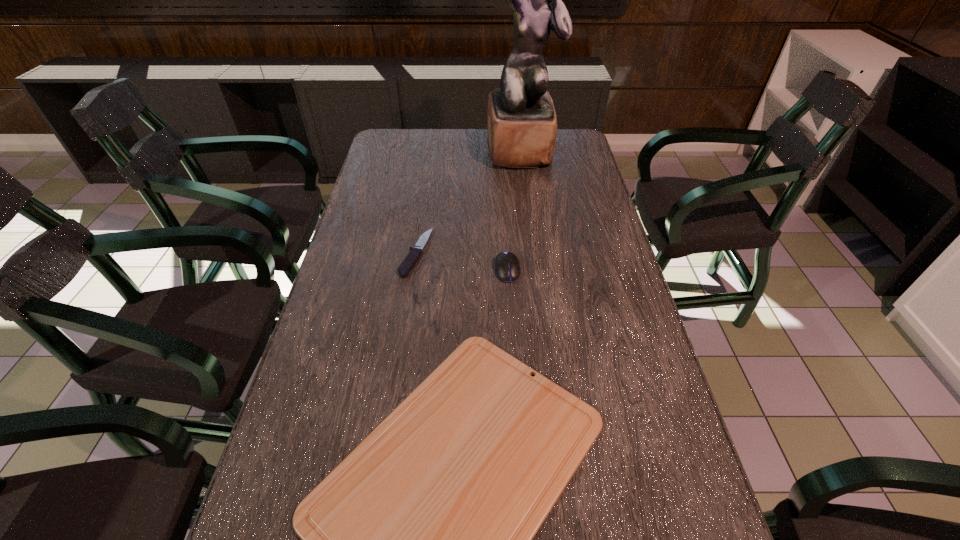
The height and width of the screenshot is (540, 960). Identify the location of free space at the far edge. (475, 131).

The height and width of the screenshot is (540, 960). I want to click on vacant space at the left edge of the desktop, so click(380, 314).

Find the location of a particular element. The width and height of the screenshot is (960, 540). vacant space at the right edge of the desktop is located at coordinates (572, 211).

At what (x,y) coordinates should I click in order to perform the action: click on vacant region at the far right corner of the desktop. Please return your answer as a coordinate pair (x, y). The image size is (960, 540). Looking at the image, I should click on (580, 153).

Where is `empty location between the steak knife and the computer mouse`? empty location between the steak knife and the computer mouse is located at coordinates (462, 262).

This screenshot has height=540, width=960. I want to click on free space between the sculpture and the third shortest object, so coord(515,210).

This screenshot has width=960, height=540. I want to click on vacant area that lies between the tallest object and the second tallest object, so click(x=515, y=210).

Identify the location of free space between the second tallest object and the third tallest object. The image size is (960, 540). (462, 262).

Locate which object ranks third in proximity to the steak knife. Please provide its 2D coordinates. Your answer should be formatted as a tuple, i.e. [(x, y)], where the tuple contains the x and y coordinates of a point satisfying the conditions above.

[(521, 120)]

The width and height of the screenshot is (960, 540). I want to click on object that is the third closest one to the steak knife, so click(x=521, y=120).